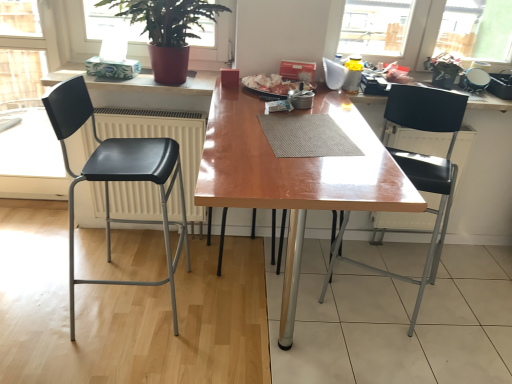
Locate an element on the screen. The width and height of the screenshot is (512, 384). vacant space that is to the left of black matte chair at left, which is counted as the 1th chair, starting from the left is located at coordinates (46, 289).